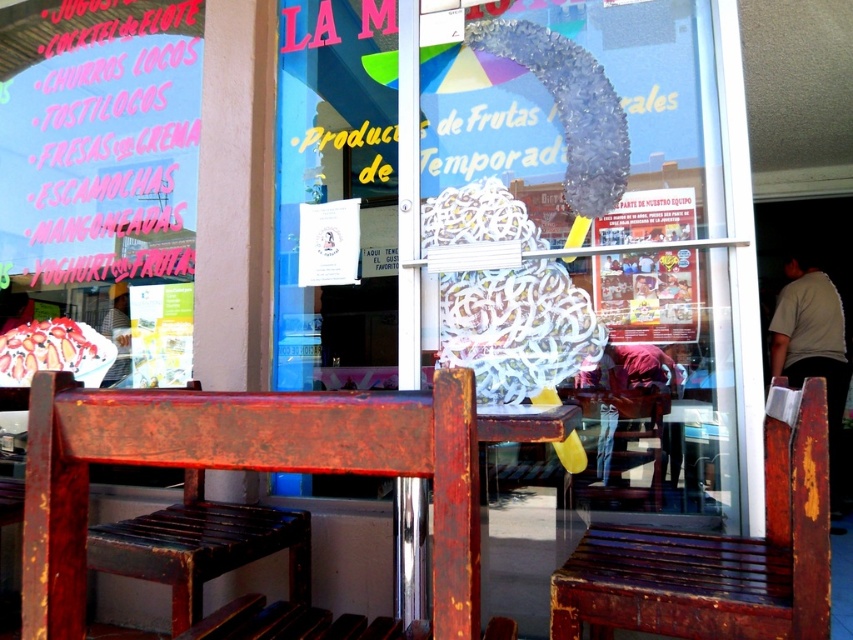
Question: Where is transparent plastic wreath at center located in relation to rusty wood bench at lower center in the image?

Choices:
 (A) left
 (B) right

Answer: (A)

Question: Can you confirm if rusty wood chair at center is bigger than rusty wood bench at lower center?

Choices:
 (A) yes
 (B) no

Answer: (B)

Question: Which point appears closest to the camera in this image?

Choices:
 (A) (300, 458)
 (B) (299, 122)
 (C) (630, 436)
 (D) (790, 502)

Answer: (A)

Question: Is transparent plastic wreath at center below rusty wooden chair at lower center?

Choices:
 (A) no
 (B) yes

Answer: (A)

Question: Which point is closer to the camera taking this photo?

Choices:
 (A) (447, 380)
 (B) (575, 397)

Answer: (A)

Question: Estimate the real-world distances between objects in this image. Which object is farther from the transparent plastic wreath at center?

Choices:
 (A) rusty wooden chair at lower center
 (B) rusty wood bench at lower center

Answer: (B)